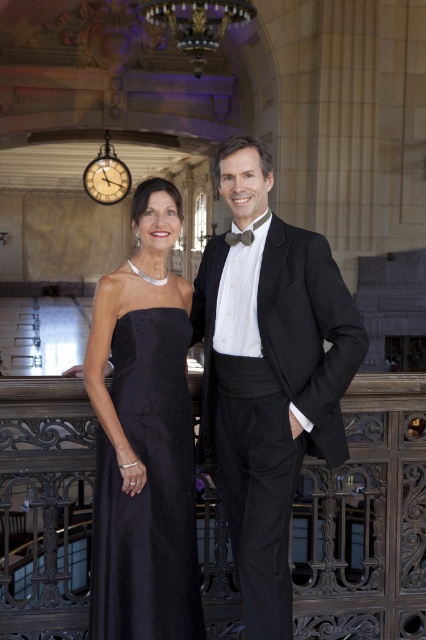
Which of these two, satin/black dress at center or textured brown bow tie at center, stands shorter?

textured brown bow tie at center

Which is more to the left, satin/black dress at center or textured brown bow tie at center?

satin/black dress at center is more to the left.

Where is `satin/black dress at center`? This screenshot has height=640, width=426. satin/black dress at center is located at coordinates (147, 490).

Find the location of a particular element. satin/black dress at center is located at coordinates (147, 490).

Does shiny black tuxedo at center appear on the left side of textured brown bow tie at center?

No, shiny black tuxedo at center is not to the left of textured brown bow tie at center.

Consider the image. Does shiny black tuxedo at center have a greater width compared to textured brown bow tie at center?

Yes, shiny black tuxedo at center is wider than textured brown bow tie at center.

Between point (226, 150) and point (233, 232), which one is positioned behind?

Positioned behind is point (233, 232).

Locate an element on the screen. The width and height of the screenshot is (426, 640). shiny black tuxedo at center is located at coordinates (268, 372).

Does shiny black tuxedo at center appear on the left side of satin/black dress at center?

In fact, shiny black tuxedo at center is to the right of satin/black dress at center.

Which is behind, point (350, 308) or point (143, 413)?

The point (143, 413) is behind.

Locate an element on the screen. This screenshot has width=426, height=640. shiny black tuxedo at center is located at coordinates (268, 372).